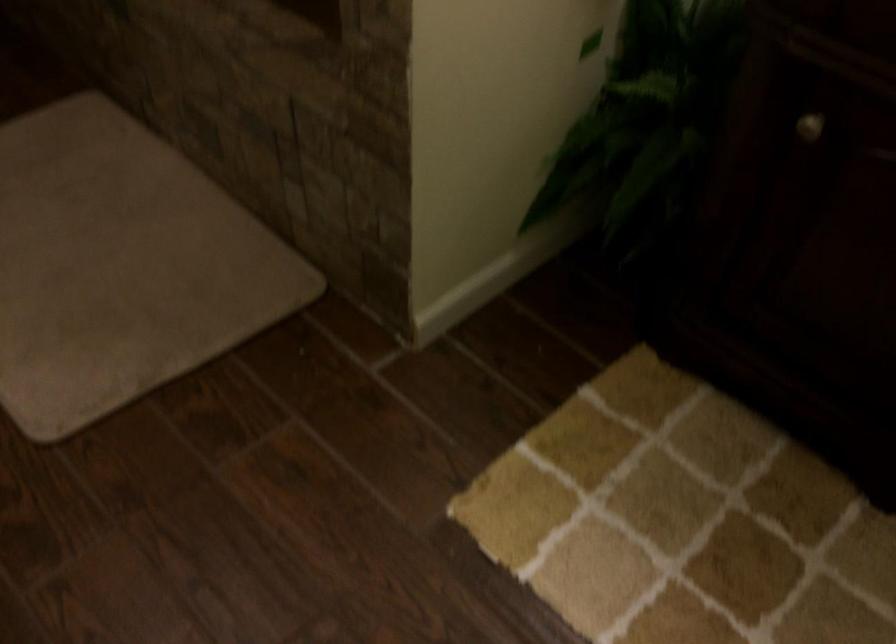
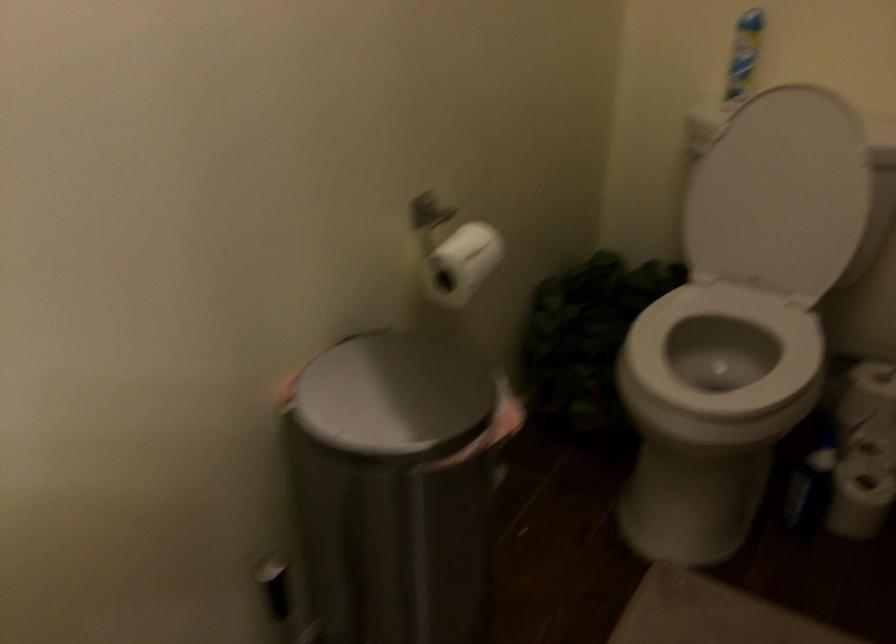
Question: The camera is either moving clockwise (left) or counter-clockwise (right) around the object. The first image is from the beginning of the video and the second image is from the end. Is the camera moving left or right when shooting the video?

Choices:
 (A) Left
 (B) Right

Answer: (B)